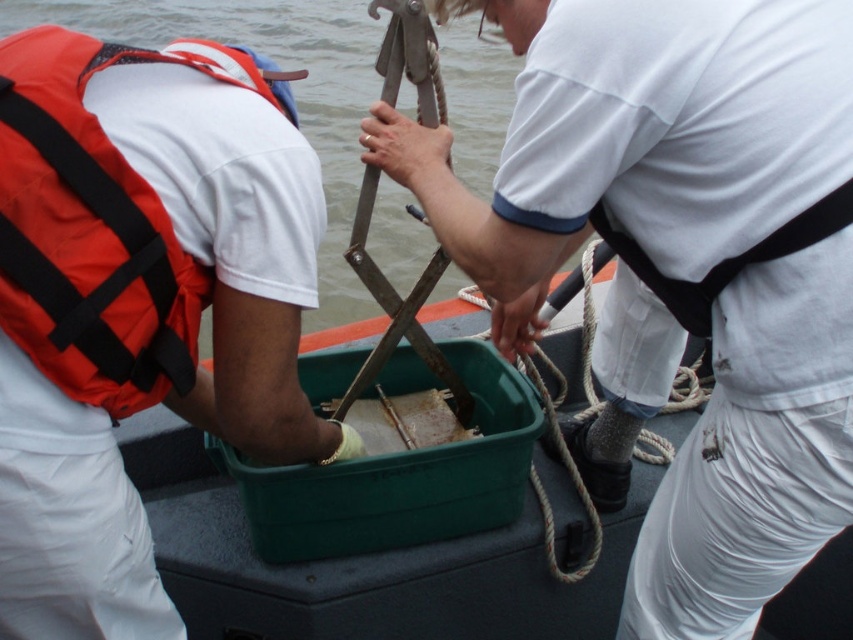
Question: Does white matte shirt at center come behind orange fabric life jacket at left?

Choices:
 (A) no
 (B) yes

Answer: (B)

Question: Can you confirm if orange fabric life jacket at left is positioned above clear water at upper center?

Choices:
 (A) no
 (B) yes

Answer: (A)

Question: Which object appears closest to the camera in this image?

Choices:
 (A) white matte shirt at center
 (B) clear water at upper center

Answer: (A)

Question: Which point is farther to the camera?

Choices:
 (A) (781, 438)
 (B) (20, 257)
 (C) (323, 301)

Answer: (C)

Question: Which point is farther to the camera?

Choices:
 (A) (70, 221)
 (B) (459, 33)

Answer: (B)

Question: Can you confirm if white matte shirt at center is smaller than clear water at upper center?

Choices:
 (A) no
 (B) yes

Answer: (B)